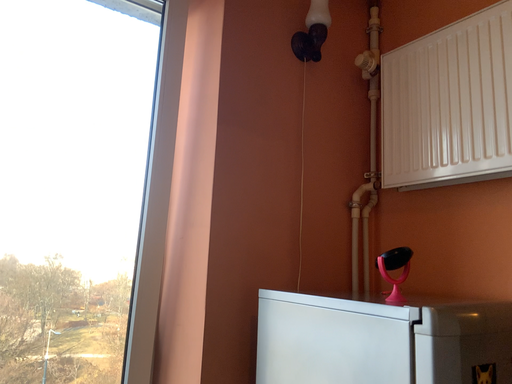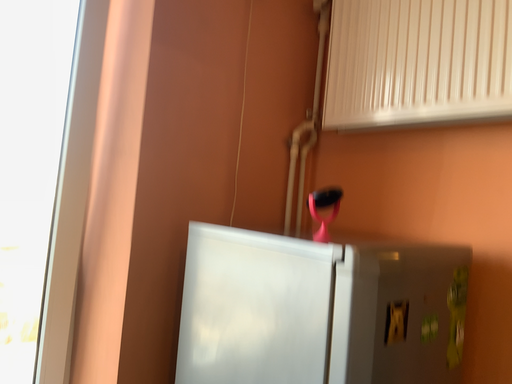
Question: How did the camera likely rotate when shooting the video?

Choices:
 (A) rotated downward
 (B) rotated upward

Answer: (A)